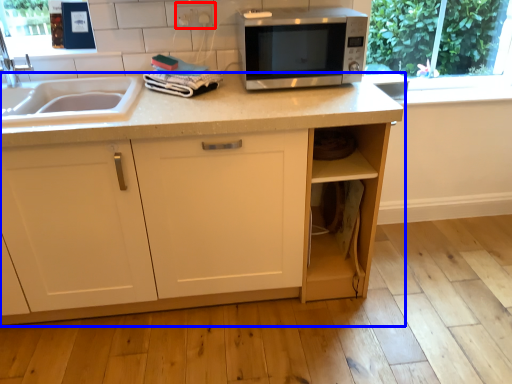
Question: Which object appears farthest to the camera in this image, electric outlet (highlighted by a red box) or cabinetry (highlighted by a blue box)?

Choices:
 (A) electric outlet
 (B) cabinetry

Answer: (A)